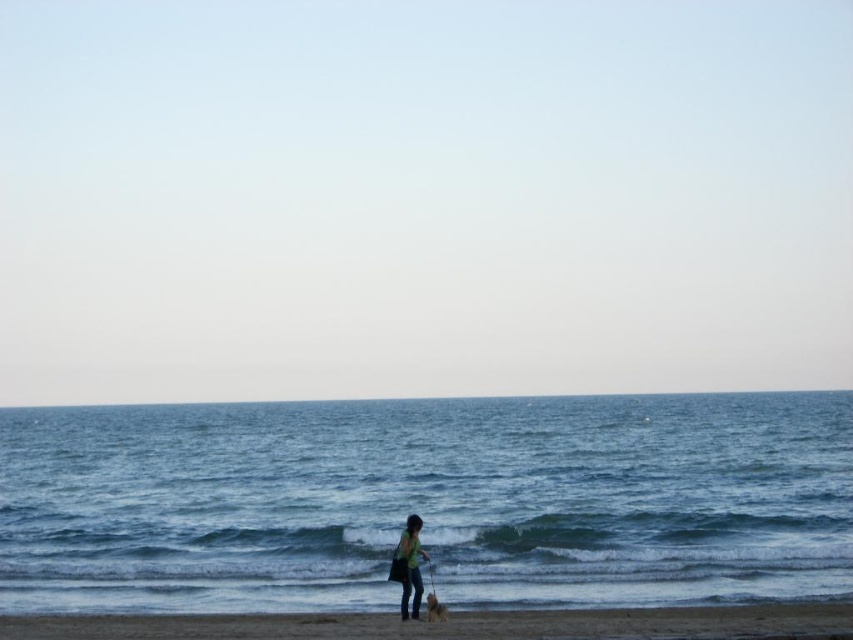
Can you confirm if brown sand at lower center is positioned below green fabric shirt at lower center?

Yes.

Who is more forward, (599,628) or (405,572)?

Point (599,628) is more forward.

Locate an element on the screen. brown sand at lower center is located at coordinates (459, 625).

You are a GUI agent. You are given a task and a screenshot of the screen. Output one action in this format:
    pyautogui.click(x=<x>, y=<y>)
    Task: Click on the brown sand at lower center
    
    Given the screenshot: What is the action you would take?
    [459, 625]

Does blue water at lower center appear on the right side of brown sand at lower center?

In fact, blue water at lower center is to the left of brown sand at lower center.

Is point (831, 512) in front of point (711, 627)?

No, it is not.

The width and height of the screenshot is (853, 640). What do you see at coordinates (426, 500) in the screenshot?
I see `blue water at lower center` at bounding box center [426, 500].

At what (x,y) coordinates should I click in order to perform the action: click on blue water at lower center. Please return your answer as a coordinate pair (x, y). This screenshot has height=640, width=853. Looking at the image, I should click on (426, 500).

Is green fabric shirt at lower center in front of short-haired brown dog at lower center?

No.

Who is more distant from viewer, (407, 573) or (436, 600)?

The point (407, 573) is behind.

Where is `green fabric shirt at lower center`? green fabric shirt at lower center is located at coordinates (408, 566).